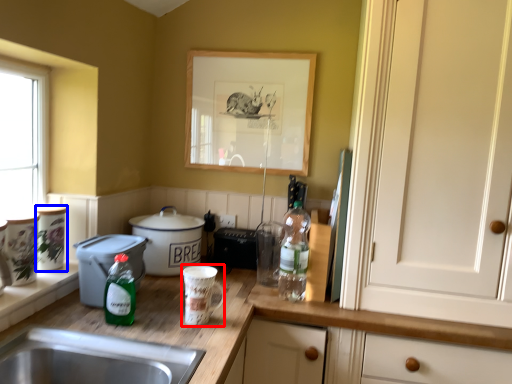
Question: Which object is further to the camera taking this photo, appliance (highlighted by a red box) or appliance (highlighted by a blue box)?

Choices:
 (A) appliance
 (B) appliance

Answer: (B)